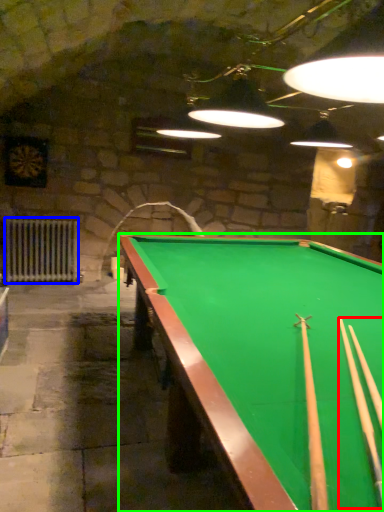
Question: Which is nearer to the cue (highlighted by a red box)? radiator (highlighted by a blue box) or billiard table (highlighted by a green box).

Choices:
 (A) radiator
 (B) billiard table

Answer: (B)